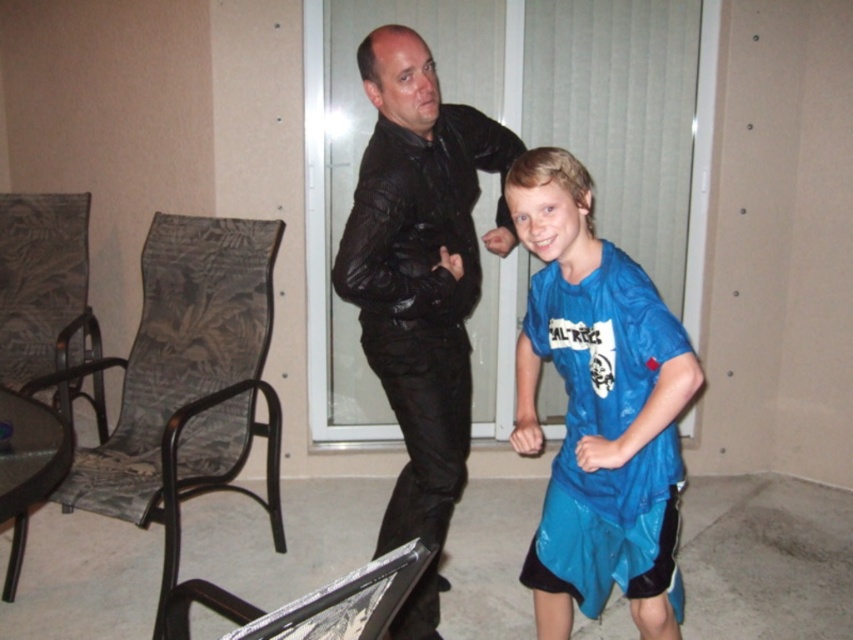
Which is behind, point (593, 547) or point (473, 243)?

The point (473, 243) is behind.

Is blue shiny t-shirt at center to the left of black leather jacket at center from the viewer's perspective?

Incorrect, blue shiny t-shirt at center is not on the left side of black leather jacket at center.

You are a GUI agent. You are given a task and a screenshot of the screen. Output one action in this format:
    pyautogui.click(x=<x>, y=<y>)
    Task: Click on the blue shiny t-shirt at center
    Image resolution: width=853 pixels, height=640 pixels.
    Given the screenshot: What is the action you would take?
    pyautogui.click(x=598, y=410)

The width and height of the screenshot is (853, 640). In order to click on blue shiny t-shirt at center in this screenshot , I will do `click(598, 410)`.